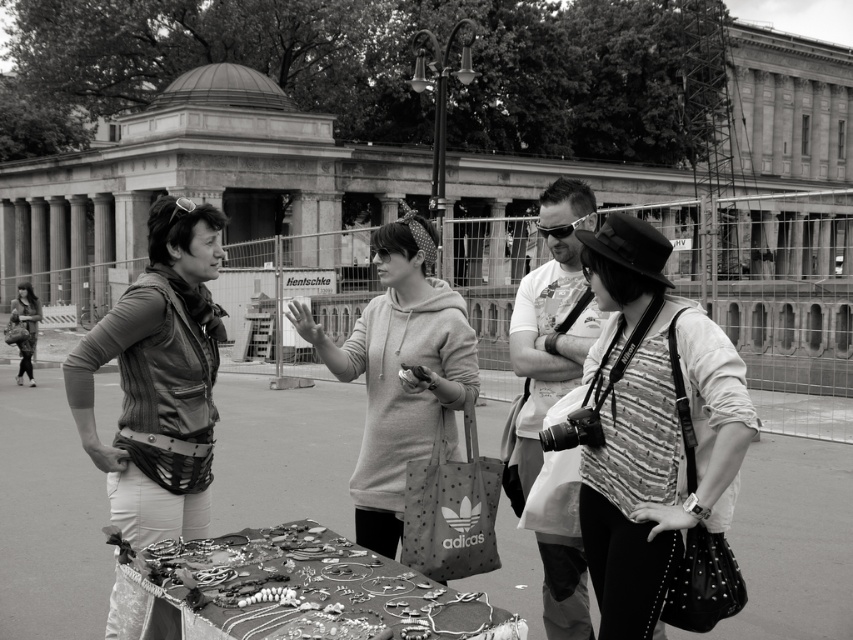
Consider the image. You are a tailor trying to fit a customer for a new jacket. The customer has a leather jacket at center and a light gray hoodie at center. Which garment would require more fabric in terms of thickness? Please explain based on the garments shown in the image.

The light gray hoodie at center would require more fabric in terms of thickness because the leather jacket at center is thinner than the light gray hoodie at center.

You are standing at the entrance of the historical building in the background and want to approach the light gray hoodie at center. Which direction should you move to reach it?

Since the light gray hoodie at center is located at point 0.583 on the x axis and 0.470 on the y axis, you should move towards the center of the image to reach it.